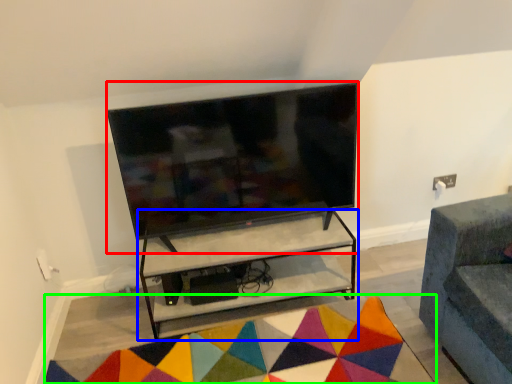
Question: Estimate the real-world distances between objects in this image. Which object is closer to television (highlighted by a red box), shelf (highlighted by a blue box) or mat (highlighted by a green box)?

Choices:
 (A) shelf
 (B) mat

Answer: (A)